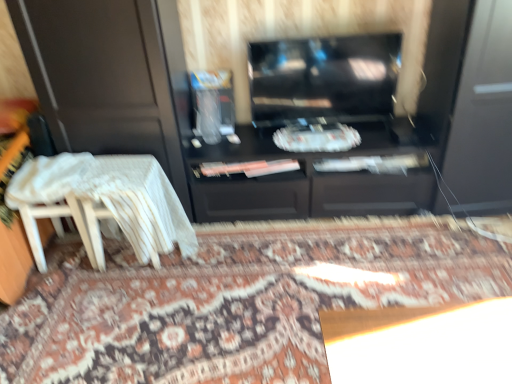
Describe the element at coordinates (213, 104) in the screenshot. This screenshot has width=512, height=384. I see `clear plastic container at center` at that location.

Image resolution: width=512 pixels, height=384 pixels. What do you see at coordinates (62, 228) in the screenshot?
I see `white wood chair at left` at bounding box center [62, 228].

I want to click on clear plastic container at center, so click(213, 104).

From a real-world perspective, who is located higher, glossy black tv at center or white lace table at lower left?

In real-world perspective, glossy black tv at center is above.

At what (x,y) coordinates should I click in order to perform the action: click on television to the right of white lace table at lower left. Please return your answer as a coordinate pair (x, y). The width and height of the screenshot is (512, 384). Looking at the image, I should click on 323,78.

Can you tell me how much glossy black tv at center and white lace table at lower left differ in facing direction?

The angular difference between glossy black tv at center and white lace table at lower left is 4.7 degrees.

Does glossy black tv at center turn towards white lace table at lower left?

No, glossy black tv at center is not oriented towards white lace table at lower left.

At what (x,y) coordinates should I click in order to perform the action: click on mat lying in front of the white lace table at lower left. Please return your answer as a coordinate pair (x, y). This screenshot has height=384, width=512. Looking at the image, I should click on (237, 300).

Is patterned carpet at center not close to white lace table at lower left?

No, patterned carpet at center is not far from white lace table at lower left.

Which of these two, patterned carpet at center or white lace table at lower left, is bigger?

patterned carpet at center.

Is white lace table at lower left a part of patterned carpet at center?

No.

From the image's perspective, between patterned carpet at center and clear plastic container at center, who is located below?

patterned carpet at center.

From a real-world perspective, is patterned carpet at center beneath clear plastic container at center?

Indeed, from a real-world perspective, patterned carpet at center is positioned beneath clear plastic container at center.

Does patterned carpet at center turn towards clear plastic container at center?

No, patterned carpet at center does not turn towards clear plastic container at center.

Does point (71, 163) appear closer or farther from the camera than point (454, 241)?

Point (71, 163) is closer to the camera than point (454, 241).

Is white lace table at lower left surrounding patterned carpet at center?

No, patterned carpet at center is not a part of white lace table at lower left.

How different are the orientations of white lace table at lower left and patterned carpet at center in degrees?

white lace table at lower left and patterned carpet at center are facing 93.6 degrees away from each other.

Is white lace table at lower left next to patterned carpet at center and touching it?

white lace table at lower left and patterned carpet at center are clearly separated.

Which of these two, clear plastic container at center or patterned carpet at center, is smaller?

clear plastic container at center is smaller.

Consider the image. Is clear plastic container at center not within patterned carpet at center?

Indeed, clear plastic container at center is completely outside patterned carpet at center.

At what (x,y) coordinates should I click in order to perform the action: click on mat below the clear plastic container at center (from the image's perspective). Please return your answer as a coordinate pair (x, y). The height and width of the screenshot is (384, 512). Looking at the image, I should click on (237, 300).

Is there a large distance between clear plastic container at center and patterned carpet at center?

No, clear plastic container at center is not far away from patterned carpet at center.

Is white lace table at lower left not within white wood chair at left?

Absolutely, white lace table at lower left is external to white wood chair at left.

Are white lace table at lower left and white wood chair at left far apart?

Actually, white lace table at lower left and white wood chair at left are a little close together.

Does point (138, 215) come farther from viewer compared to point (102, 258)?

No, (138, 215) is in front of (102, 258).

From the image's perspective, which one is positioned lower, white lace table at lower left or white wood chair at left?

From the image's view, white lace table at lower left is below.

From a real-world perspective, between white wood chair at left and glossy black tv at center, who is vertically higher?

glossy black tv at center, from a real-world perspective.

Can you see white wood chair at left touching glossy black tv at center?

white wood chair at left is not next to glossy black tv at center, and they're not touching.

In the image, is white wood chair at left positioned in front of or behind glossy black tv at center?

white wood chair at left is positioned closer to the viewer than glossy black tv at center.

What's the angular difference between white wood chair at left and glossy black tv at center's facing directions?

They differ by 3.5 degrees in their facing directions.

You are a GUI agent. You are given a task and a screenshot of the screen. Output one action in this format:
    pyautogui.click(x=<x>, y=<y>)
    Task: Click on the table in front of the glossy black tv at center
    
    Given the screenshot: What is the action you would take?
    pyautogui.click(x=113, y=197)

You are a GUI agent. You are given a task and a screenshot of the screen. Output one action in this format:
    pyautogui.click(x=<x>, y=<y>)
    Task: Click on the mat below the white lace table at lower left (from the image's perspective)
    The image size is (512, 384).
    Given the screenshot: What is the action you would take?
    pyautogui.click(x=237, y=300)

Looking at the image, which one is located closer to glossy black tv at center, clear plastic container at center or white wood chair at left?

clear plastic container at center lies closer to glossy black tv at center than the other object.

Looking at this image, from the image, which object appears to be nearer to patterned carpet at center, white wood chair at left or white lace table at lower left?

white lace table at lower left is positioned closer to the anchor patterned carpet at center.

Looking at the image, which one is located further to clear plastic container at center, glossy black tv at center or patterned carpet at center?

patterned carpet at center is positioned further to the anchor clear plastic container at center.

Looking at the image, which one is located closer to glossy black tv at center, white wood chair at left or patterned carpet at center?

patterned carpet at center is positioned closer to the anchor glossy black tv at center.

When comparing their distances from patterned carpet at center, does glossy black tv at center or clear plastic container at center seem closer?

clear plastic container at center is closer to patterned carpet at center.

From the image, which object appears to be nearer to clear plastic container at center, glossy black tv at center or white wood chair at left?

Based on the image, glossy black tv at center appears to be nearer to clear plastic container at center.

From the image, which object appears to be nearer to glossy black tv at center, white wood chair at left or white lace table at lower left?

white lace table at lower left lies closer to glossy black tv at center than the other object.

Which object lies nearer to the anchor point white wood chair at left, clear plastic container at center or patterned carpet at center?

patterned carpet at center.

Find the location of a particular element. table between clear plastic container at center and patterned carpet at center from top to bottom is located at coordinates (113, 197).

Where is `table located between white wood chair at left and patterned carpet at center in the left-right direction`? Image resolution: width=512 pixels, height=384 pixels. table located between white wood chair at left and patterned carpet at center in the left-right direction is located at coordinates (113, 197).

The height and width of the screenshot is (384, 512). Find the location of `appliance located between white wood chair at left and patterned carpet at center in the left-right direction`. appliance located between white wood chair at left and patterned carpet at center in the left-right direction is located at coordinates (213, 104).

Where is `appliance between white lace table at lower left and glossy black tv at center from left to right`? The height and width of the screenshot is (384, 512). appliance between white lace table at lower left and glossy black tv at center from left to right is located at coordinates (213, 104).